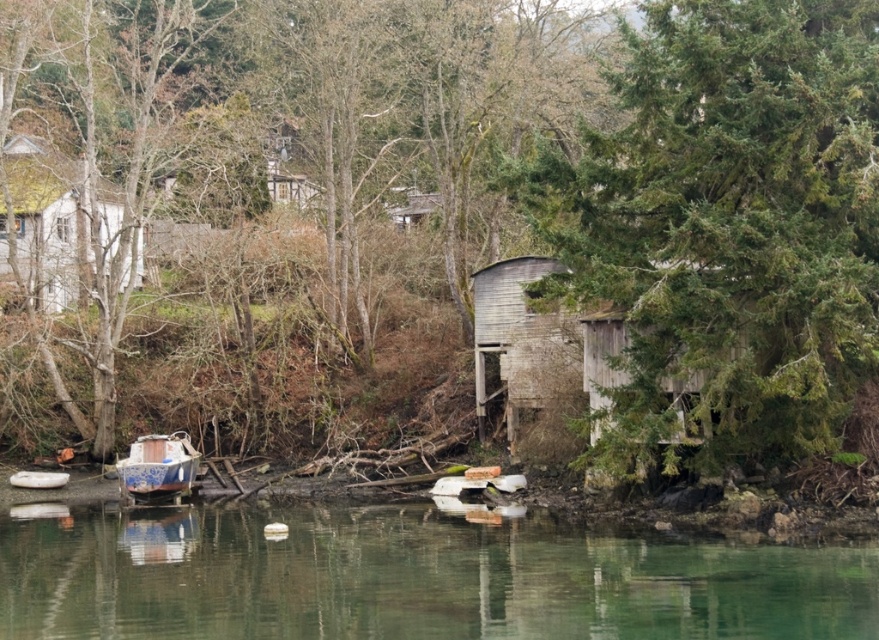
Question: Is green textured tree at center to the left of white wood cabin at upper left from the viewer's perspective?

Choices:
 (A) yes
 (B) no

Answer: (B)

Question: Considering the relative positions of clear water at lower center and white wood cabin at upper left in the image provided, where is clear water at lower center located with respect to white wood cabin at upper left?

Choices:
 (A) right
 (B) left

Answer: (A)

Question: Does clear water at lower center lie in front of blue painted wood boat at lower left?

Choices:
 (A) yes
 (B) no

Answer: (A)

Question: Which object appears closest to the camera in this image?

Choices:
 (A) clear water at lower center
 (B) green textured tree at center

Answer: (A)

Question: Which of the following is the farthest from the observer?

Choices:
 (A) green textured tree at center
 (B) white wood cabin at upper left
 (C) clear water at lower center
 (D) blue painted wood boat at lower left

Answer: (B)

Question: Which object is closer to the camera taking this photo?

Choices:
 (A) blue painted wood boat at lower left
 (B) green textured tree at center

Answer: (B)